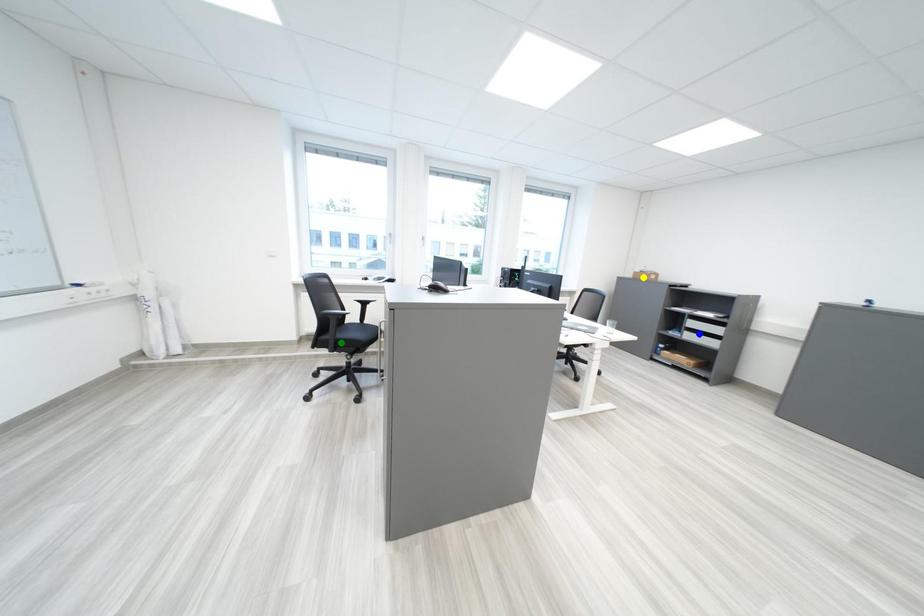
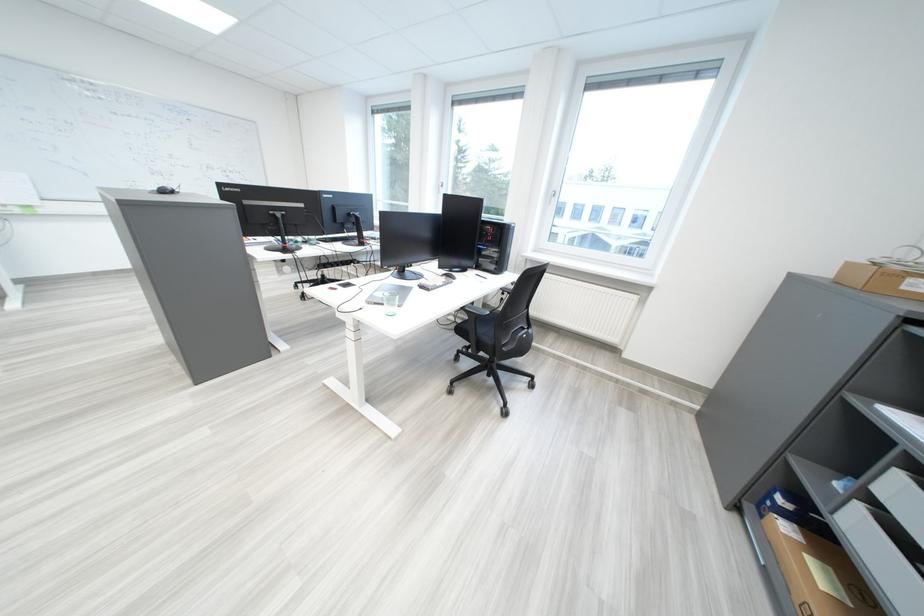
I am providing you with two images of the same scene from different viewpoints. Three points are marked in image1. Which point corresponds to a part or object that is occluded in image2?In image1, three points are marked. Which of them correspond to a part or object that is occluded in image2?Among the three points shown in image1, which one corresponds to a part or object that is no longer visible due to occlusion in image2?

green point cannot be seen in image2.